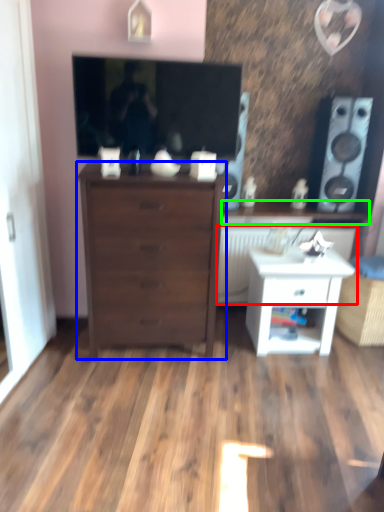
Question: Which is farther away from radiator (highlighted by a red box)? chest of drawers (highlighted by a blue box) or counter top (highlighted by a green box)?

Choices:
 (A) chest of drawers
 (B) counter top

Answer: (A)